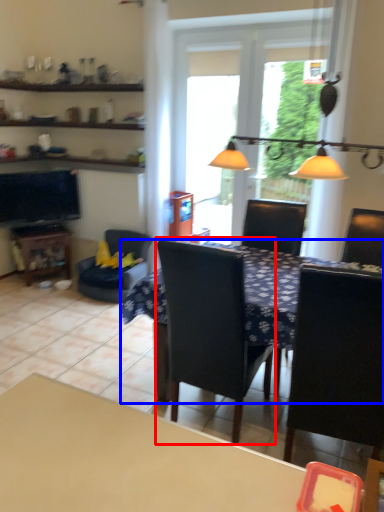
Question: Which object appears farthest to the camera in this image, chair (highlighted by a red box) or table (highlighted by a blue box)?

Choices:
 (A) chair
 (B) table

Answer: (A)